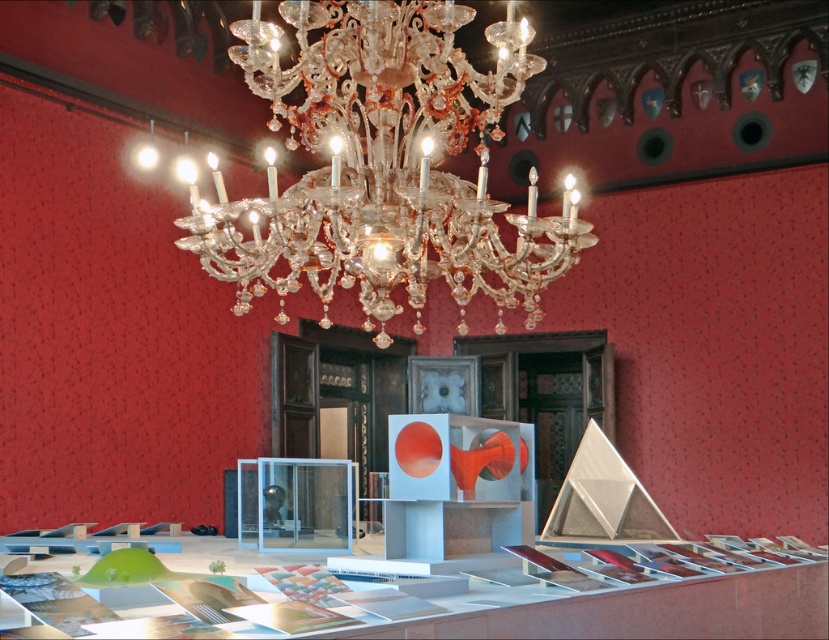
You are standing in the room and want to place a decorative centerpiece on the translucent white table at lower center. However, you notice the clear crystal chandelier at upper center might obstruct the view of the centerpiece. Based on their positions, will the chandelier block the view of the centerpiece when viewed from the entrance?

The clear crystal chandelier at upper center is positioned on the left side of the translucent white table at lower center, so when viewed from the entrance, the chandelier will only partially block the view of the centerpiece, as it is not directly in front but to the side.

You are a maintenance worker needing to clean the clear crystal chandelier at upper center. You have a ladder that can reach up to 3.5 meters. Can you safely reach the chandelier with the ladder?

The clear crystal chandelier at upper center is 3.88 meters away from the viewer. Since the ladder can only reach up to 3.5 meters, you cannot safely reach the chandelier with the ladder.

You are a maintenance worker needing to clean the clear crystal chandelier at upper center. You have a ladder that is 1.6 meters tall. Standing on the translucent white table at lower center, can you reach the chandelier?

The distance between the clear crystal chandelier at upper center and the translucent white table at lower center is 1.72 meters. Since the ladder is only 1.6 meters tall, even when standing on the table, you won